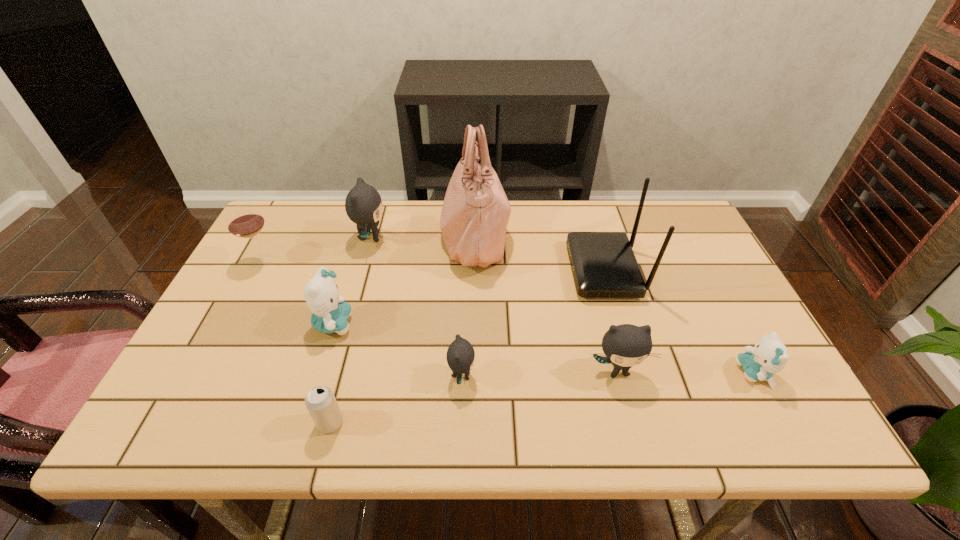
Find the location of a particular element. This screenshot has height=540, width=960. the nearer blue kitten is located at coordinates (769, 356).

Identify the location of the rightmost kitten. The height and width of the screenshot is (540, 960). pyautogui.click(x=769, y=356).

Locate an element on the screen. This screenshot has width=960, height=540. the second gray kitten from right to left is located at coordinates (460, 356).

Locate an element on the screen. The image size is (960, 540). the third kitten from left to right is located at coordinates (460, 356).

Identify the location of the nearest object. (320, 401).

This screenshot has width=960, height=540. In order to click on white beer can in this screenshot , I will do `click(320, 401)`.

You are a GUI agent. You are given a task and a screenshot of the screen. Output one action in this format:
    pyautogui.click(x=<x>, y=<y>)
    Task: Click on the vacant space located 0.140m at the front of the handbag with handles
    
    Given the screenshot: What is the action you would take?
    pyautogui.click(x=555, y=237)

Image resolution: width=960 pixels, height=540 pixels. Find the location of `vacant area located on the front-facing side of the router`. vacant area located on the front-facing side of the router is located at coordinates pyautogui.click(x=445, y=271).

Identify the location of vacant space located on the front-facing side of the router. (531, 271).

This screenshot has height=540, width=960. Identify the location of vacant space located 0.220m on the front-facing side of the router. (492, 271).